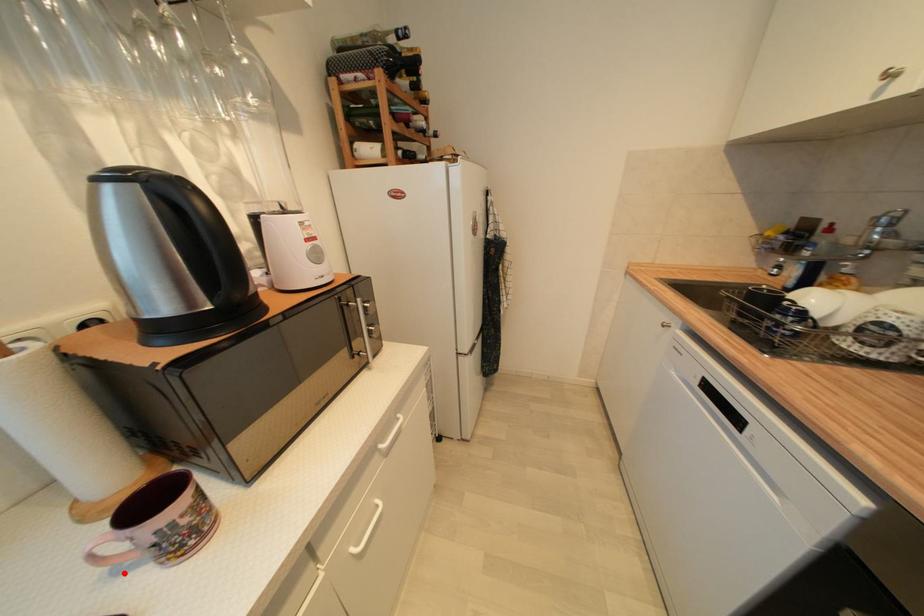
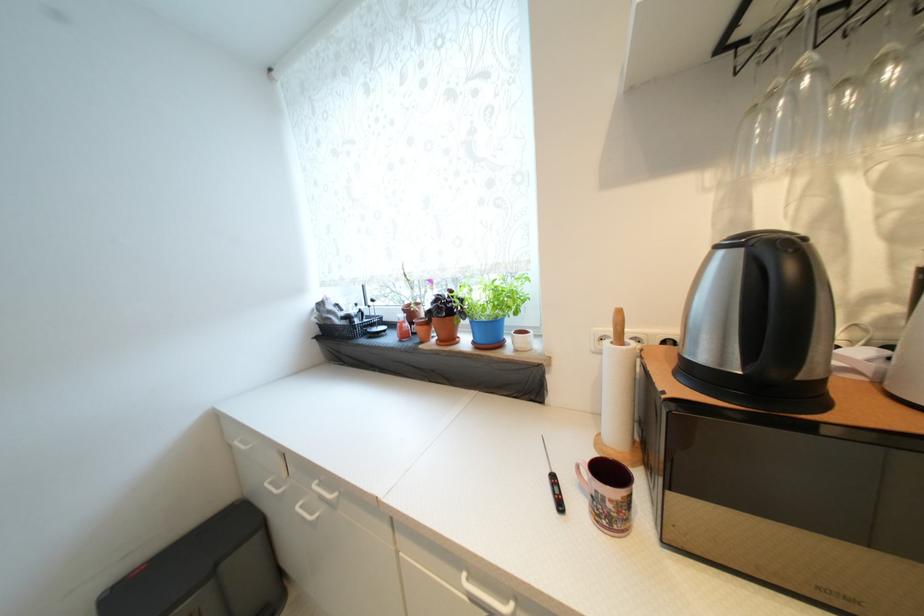
Find the pixel in the second image that matches the highlighted location in the first image.

(586, 488)